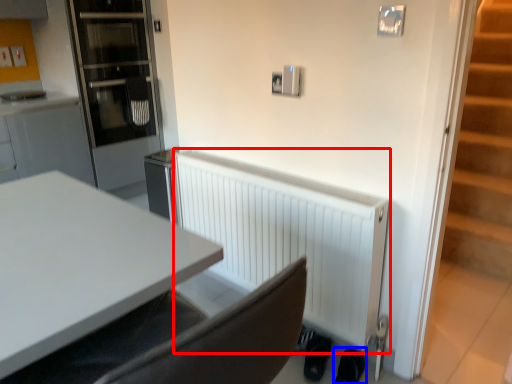
Question: Which of the following is the closest to the observer, radiator (highlighted by a red box) or shoe (highlighted by a blue box)?

Choices:
 (A) radiator
 (B) shoe

Answer: (A)